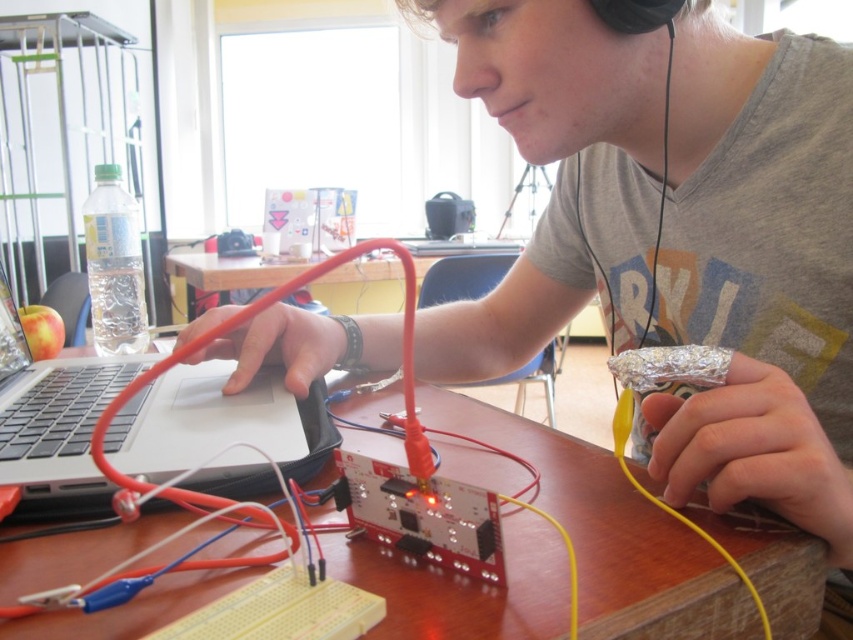
Question: Does matte gray shirt at center have a larger size compared to wooden table at center?

Choices:
 (A) no
 (B) yes

Answer: (B)

Question: Can you confirm if matte gray shirt at center is smaller than wooden table at center?

Choices:
 (A) yes
 (B) no

Answer: (B)

Question: Which of the following is the closest to the observer?

Choices:
 (A) (531, 328)
 (B) (253, 276)
 (C) (22, 625)

Answer: (C)

Question: Does matte gray shirt at center have a greater width compared to silver/black laptop at center?

Choices:
 (A) no
 (B) yes

Answer: (B)

Question: Among these points, which one is farthest from the camera?

Choices:
 (A) (462, 28)
 (B) (389, 307)
 (C) (619, 496)

Answer: (B)

Question: Considering the real-world distances, which object is closest to the rubberized plastic table at center?

Choices:
 (A) silver/black laptop at center
 (B) wooden table at center
 (C) matte gray shirt at center

Answer: (C)